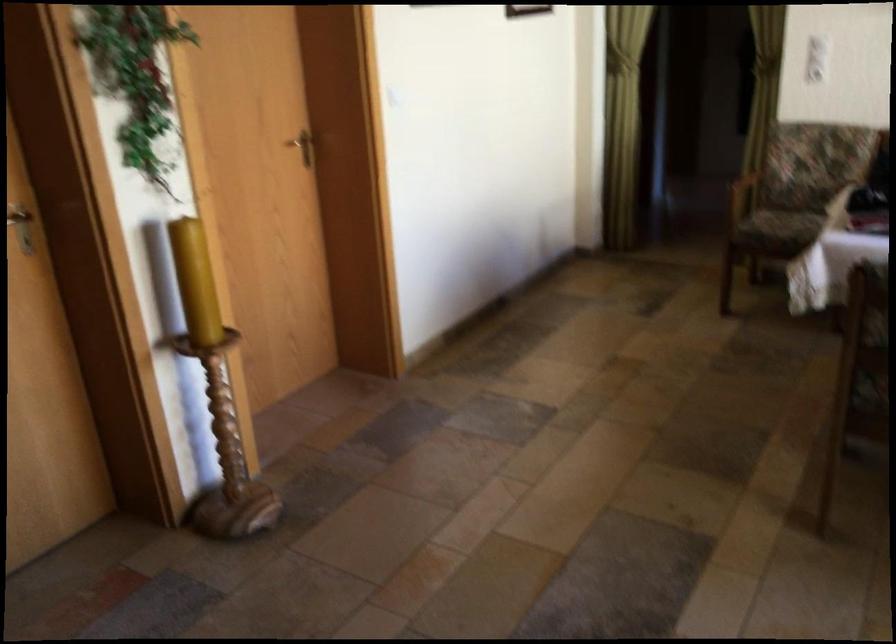
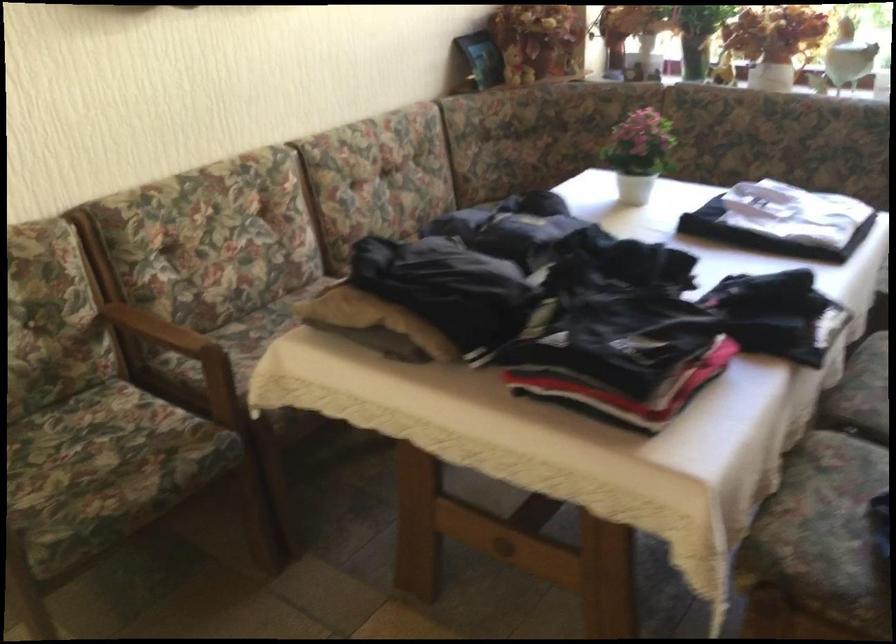
Locate, in the second image, the point that corresponds to the point at 793,214 in the first image.

(67, 444)